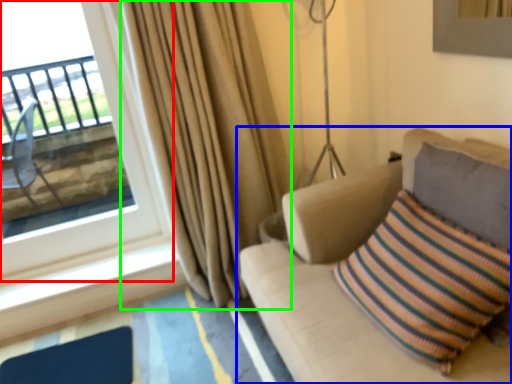
Question: Which is nearer to the window (highlighted by a red box)? studio couch (highlighted by a blue box) or curtain (highlighted by a green box).

Choices:
 (A) studio couch
 (B) curtain

Answer: (B)